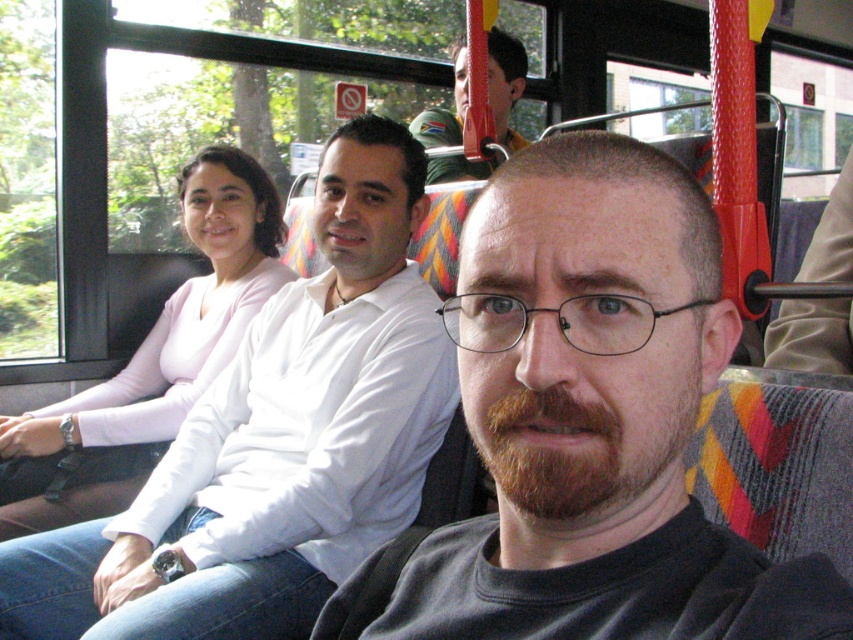
Between dark gray shirt at center and green fabric cap at upper center, which one is positioned higher?

green fabric cap at upper center

Is dark gray shirt at center to the left of green fabric cap at upper center from the viewer's perspective?

Indeed, dark gray shirt at center is positioned on the left side of green fabric cap at upper center.

Between point (624, 310) and point (428, 129), which one is positioned behind?

Positioned behind is point (428, 129).

Find the location of `dark gray shirt at center`. dark gray shirt at center is located at coordinates (587, 426).

Does point (502, 548) lie behind point (178, 180)?

No, (502, 548) is in front of (178, 180).

Between point (669, 381) and point (233, 260), which one is positioned behind?

Positioned behind is point (233, 260).

Is point (663, 179) positioned before point (30, 524)?

Yes, it is.

This screenshot has width=853, height=640. In order to click on dark gray shirt at center in this screenshot , I will do `click(587, 426)`.

Is pink matte sweater at upper left thinner than green fabric cap at upper center?

No.

Which is below, pink matte sweater at upper left or green fabric cap at upper center?

pink matte sweater at upper left is lower down.

The height and width of the screenshot is (640, 853). Identify the location of pink matte sweater at upper left. tap(151, 360).